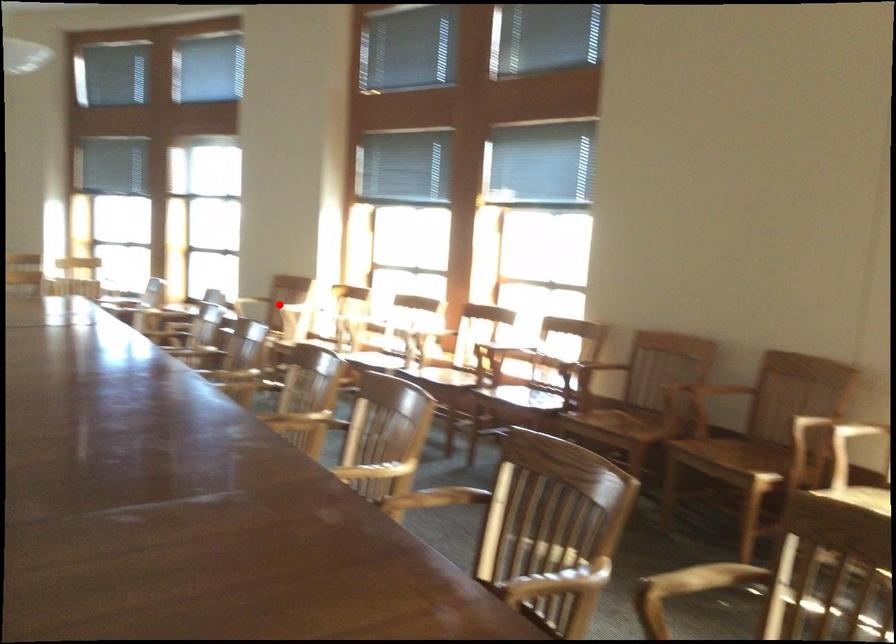
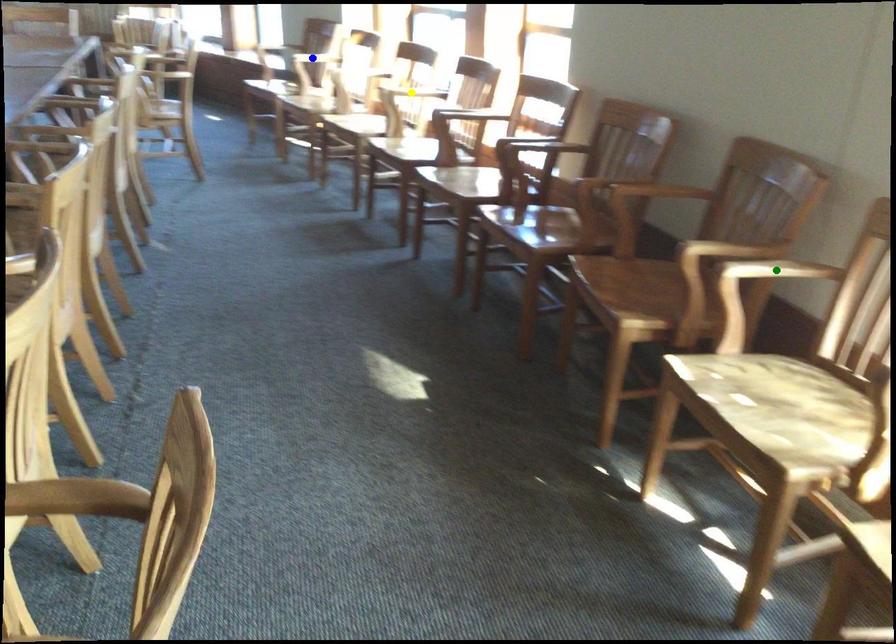
Question: I am providing you with two images of the same scene from different viewpoints. A red point is marked on the first image. You are given multiple points on the second image. Which mark in image 2 goes with the point in image 1?

Choices:
 (A) yellow point
 (B) green point
 (C) blue point

Answer: (C)